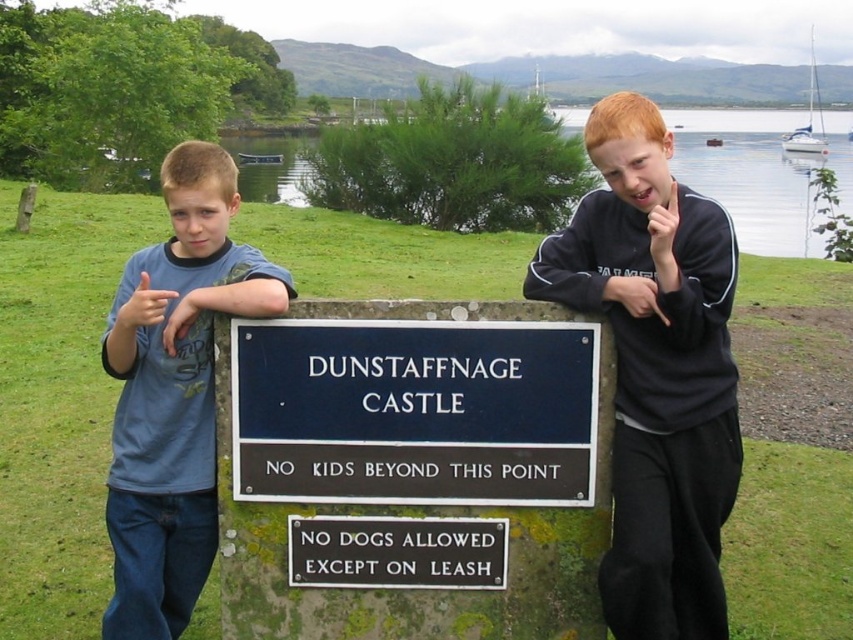
Question: Which point appears closest to the camera in this image?

Choices:
 (A) (422, 576)
 (B) (408, 468)

Answer: (B)

Question: Is blue t-shirt at left behind black metal sign at center?

Choices:
 (A) yes
 (B) no

Answer: (B)

Question: Which of the following is the closest to the observer?

Choices:
 (A) black fleece at right
 (B) black metal sign at center
 (C) blue t-shirt at left
 (D) dark blue metal sign at center

Answer: (A)

Question: Does black fleece at right appear over blue t-shirt at left?

Choices:
 (A) yes
 (B) no

Answer: (A)

Question: Which point is farther to the camera?

Choices:
 (A) (579, 470)
 (B) (161, 500)
 (C) (718, 460)

Answer: (B)

Question: From the image, what is the correct spatial relationship of black fleece at right in relation to black metal sign at center?

Choices:
 (A) right
 (B) left

Answer: (A)